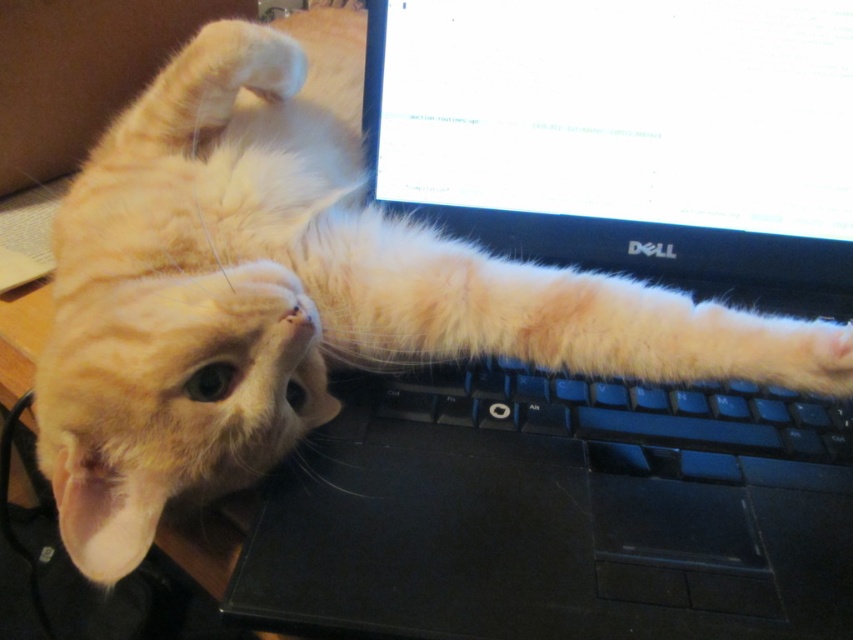
Can you confirm if black plastic keyboard at center is thinner than orange fur at upper left?

No, black plastic keyboard at center is not thinner than orange fur at upper left.

Does black plastic keyboard at center have a greater height compared to orange fur at upper left?

In fact, black plastic keyboard at center may be shorter than orange fur at upper left.

This screenshot has width=853, height=640. In order to click on black plastic keyboard at center in this screenshot , I will do `click(622, 410)`.

Identify the location of black plastic keyboard at center. This screenshot has height=640, width=853. (622, 410).

Does white glossy screen at upper center have a larger size compared to black plastic keyboard at center?

Yes.

At what (x,y) coordinates should I click in order to perform the action: click on white glossy screen at upper center. Please return your answer as a coordinate pair (x, y). Looking at the image, I should click on (622, 131).

Identify the location of white glossy screen at upper center. This screenshot has height=640, width=853. (622, 131).

Describe the element at coordinates (622, 131) in the screenshot. This screenshot has width=853, height=640. I see `white glossy screen at upper center` at that location.

Between white glossy screen at upper center and orange fur at upper left, which one has more height?

orange fur at upper left is taller.

What are the coordinates of `white glossy screen at upper center` in the screenshot? It's located at (622, 131).